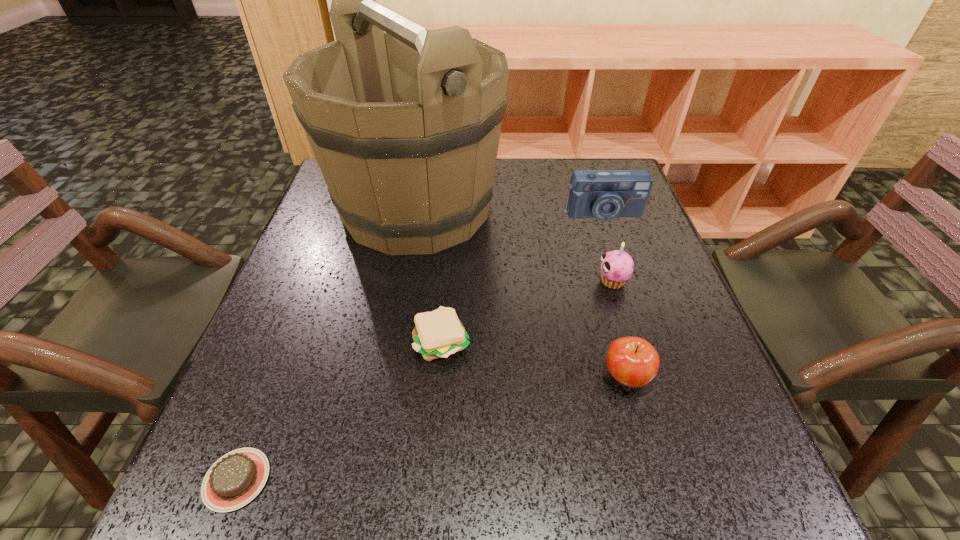
The width and height of the screenshot is (960, 540). In order to click on blank space located 0.160m on the face of the cupcake in this screenshot , I will do `click(523, 281)`.

This screenshot has width=960, height=540. I want to click on vacant space situated on the face of the cupcake, so click(421, 281).

Find the location of a particular element. This screenshot has width=960, height=540. vacant space located 0.160m on the left of the fourth tallest object is located at coordinates pos(512,376).

The width and height of the screenshot is (960, 540). I want to click on free space located 0.230m on the back of the fifth tallest object, so click(449, 244).

In order to click on vacant space located on the back of the nearest object in this screenshot , I will do `click(285, 354)`.

Where is `object that is at the far edge`? object that is at the far edge is located at coordinates (404, 122).

The image size is (960, 540). Find the location of `object that is at the near edge`. object that is at the near edge is located at coordinates click(235, 479).

Where is `bucket located in the left edge section of the desktop`? bucket located in the left edge section of the desktop is located at coordinates (404, 122).

Find the location of a particular element. This screenshot has height=540, width=960. chocolate cake that is positioned at the left edge is located at coordinates (235, 479).

Identify the location of camera that is at the right edge. (605, 195).